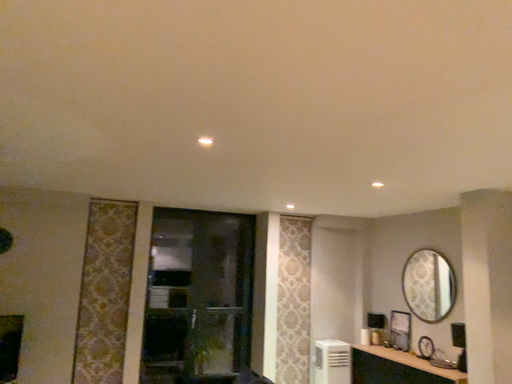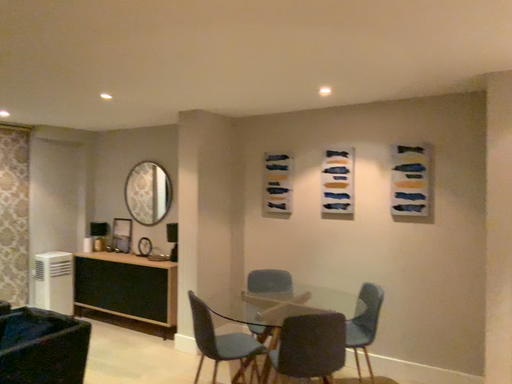
Question: How did the camera likely rotate when shooting the video?

Choices:
 (A) rotated right
 (B) rotated left

Answer: (A)